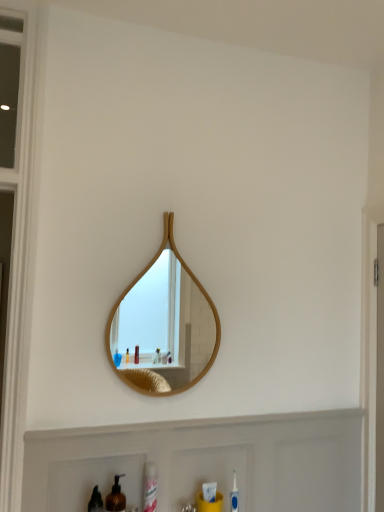
Question: Can you confirm if white matte cabinet at lower center is positioned to the right of brown matte bottle at lower left?

Choices:
 (A) no
 (B) yes

Answer: (B)

Question: Can you confirm if white matte cabinet at lower center is thinner than brown matte bottle at lower left?

Choices:
 (A) no
 (B) yes

Answer: (B)

Question: Is white matte cabinet at lower center surrounding brown matte bottle at lower left?

Choices:
 (A) no
 (B) yes

Answer: (A)

Question: From the image's perspective, would you say white matte cabinet at lower center is positioned over brown matte bottle at lower left?

Choices:
 (A) no
 (B) yes

Answer: (A)

Question: Is white matte cabinet at lower center closer to camera compared to brown matte bottle at lower left?

Choices:
 (A) no
 (B) yes

Answer: (A)

Question: Relative to wooden mirror at center, is brown matte bottle at lower left in front or behind?

Choices:
 (A) behind
 (B) front

Answer: (B)

Question: Does point (124, 500) appear closer or farther from the camera than point (170, 281)?

Choices:
 (A) closer
 (B) farther

Answer: (A)

Question: Is brown matte bottle at lower left taller or shorter than wooden mirror at center?

Choices:
 (A) tall
 (B) short

Answer: (B)

Question: From a real-world perspective, is brown matte bottle at lower left above or below wooden mirror at center?

Choices:
 (A) below
 (B) above

Answer: (A)

Question: From a real-world perspective, is white glossy spray can at lower center above or below wooden mirror at center?

Choices:
 (A) below
 (B) above

Answer: (A)

Question: Considering the positions of white glossy spray can at lower center and wooden mirror at center in the image, is white glossy spray can at lower center wider or thinner than wooden mirror at center?

Choices:
 (A) wide
 (B) thin

Answer: (A)

Question: Does point (150, 468) appear closer or farther from the camera than point (135, 311)?

Choices:
 (A) closer
 (B) farther

Answer: (A)

Question: From the image's perspective, relative to wooden mirror at center, is white glossy spray can at lower center above or below?

Choices:
 (A) below
 (B) above

Answer: (A)

Question: In terms of size, does wooden mirror at center appear bigger or smaller than white glossy spray can at lower center?

Choices:
 (A) small
 (B) big

Answer: (B)

Question: Is wooden mirror at center inside the boundaries of white glossy spray can at lower center, or outside?

Choices:
 (A) inside
 (B) outside

Answer: (B)